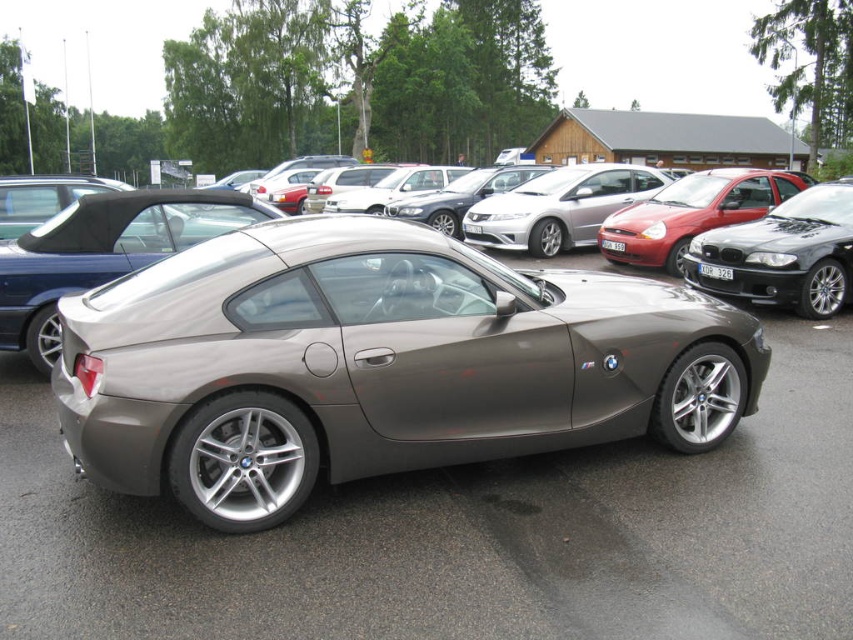
Does metallic gray car at center have a greater width compared to satin black sedan at center?

Correct, the width of metallic gray car at center exceeds that of satin black sedan at center.

Does metallic gray car at center appear under satin black sedan at center?

Correct, metallic gray car at center is located below satin black sedan at center.

Where is `metallic gray car at center`? The image size is (853, 640). metallic gray car at center is located at coordinates (467, 536).